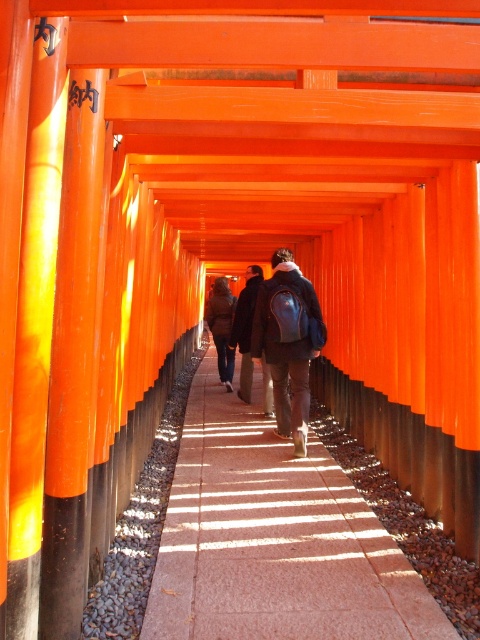
Is point (260, 604) farther from viewer compared to point (228, 344)?

No, (260, 604) is closer to viewer.

Between point (213, 408) and point (250, 275), which one is positioned in front?

Point (250, 275) is more forward.

Does point (197, 384) come closer to viewer compared to point (241, 291)?

No, it is behind (241, 291).

The height and width of the screenshot is (640, 480). What are the coordinates of `smooth stone pavement at center` in the screenshot? It's located at (274, 540).

Can you confirm if smooth stone pavement at center is positioned to the left of matte black backpack at center?

Correct, you'll find smooth stone pavement at center to the left of matte black backpack at center.

Between smooth stone pavement at center and matte black backpack at center, which one appears on the left side from the viewer's perspective?

smooth stone pavement at center

Measure the distance between point (362,532) and camera.

The distance of point (362,532) from camera is 4.81 meters.

Identify the location of smooth stone pavement at center. (274, 540).

Is matte black backpack at center taller than dark brown leather jacket at center?

Indeed, matte black backpack at center has a greater height compared to dark brown leather jacket at center.

Which is in front, point (303, 292) or point (244, 385)?

Positioned in front is point (303, 292).

Which is in front, point (286, 301) or point (266, 385)?

Point (286, 301) is in front.

Where is `matte black backpack at center`? The image size is (480, 640). matte black backpack at center is located at coordinates (288, 342).